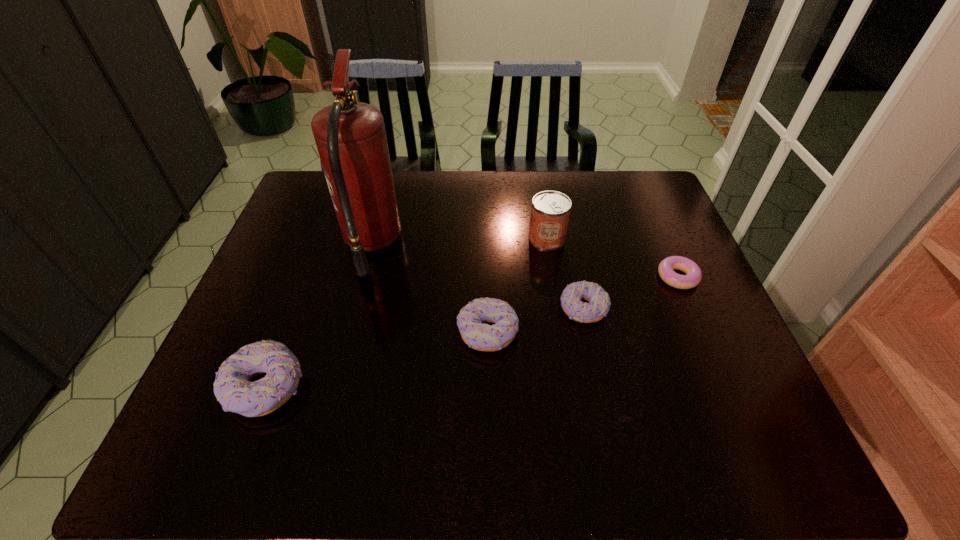
Where is `free region located 0.190m on the back of the third shortest doughnut`? The image size is (960, 540). free region located 0.190m on the back of the third shortest doughnut is located at coordinates (487, 258).

Find the location of a particular element. This screenshot has height=540, width=960. vacant space located on the back of the second shortest doughnut is located at coordinates (569, 243).

The image size is (960, 540). What are the coordinates of `blank space located at the front of the tallest object where the nozzle is aimed` in the screenshot? It's located at (475, 245).

Find the location of a particular element. Image resolution: width=960 pixels, height=540 pixels. vacant region located on the front of the second tallest object is located at coordinates (560, 318).

I want to click on vacant space located 0.400m on the back of the shortest doughnut, so click(636, 182).

Identify the location of object located in the far edge section of the desktop. This screenshot has width=960, height=540. (350, 136).

The height and width of the screenshot is (540, 960). I want to click on object positioned at the near edge, so click(233, 388).

Locate an element on the screen. This screenshot has width=960, height=540. object at the left edge is located at coordinates (233, 388).

You are a GUI agent. You are given a task and a screenshot of the screen. Output one action in this format:
    pyautogui.click(x=<x>, y=<y>)
    Task: Click on the object that is at the right edge
    
    Given the screenshot: What is the action you would take?
    pyautogui.click(x=693, y=276)

Where is `object that is at the near left corner`? The height and width of the screenshot is (540, 960). object that is at the near left corner is located at coordinates (233, 388).